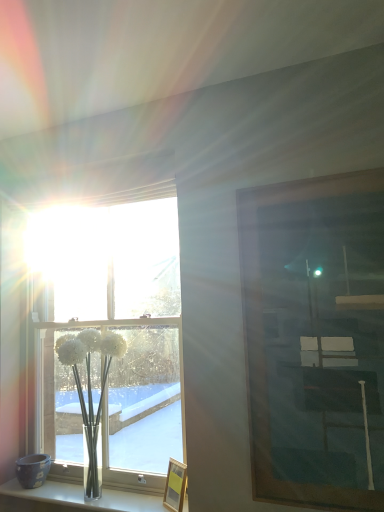
Question: From a real-world perspective, is white glass vase at lower left located beneath clear glass vase at lower left?

Choices:
 (A) yes
 (B) no

Answer: (B)

Question: Is white glass vase at lower left at the left side of clear glass vase at lower left?

Choices:
 (A) yes
 (B) no

Answer: (B)

Question: Is white glass vase at lower left wider than clear glass vase at lower left?

Choices:
 (A) no
 (B) yes

Answer: (B)

Question: From the image's perspective, is white glass vase at lower left below clear glass vase at lower left?

Choices:
 (A) yes
 (B) no

Answer: (B)

Question: Is white glass vase at lower left further to the viewer compared to clear glass vase at lower left?

Choices:
 (A) no
 (B) yes

Answer: (B)

Question: Would you say white glass vase at lower left is a long distance from clear glass vase at lower left?

Choices:
 (A) no
 (B) yes

Answer: (A)

Question: Is the depth of clear glass vase at lower left greater than that of wooden picture frame at lower center, which is the 2th picture frame in top-to-bottom order?

Choices:
 (A) no
 (B) yes

Answer: (A)

Question: From the image's perspective, is clear glass vase at lower left above wooden picture frame at lower center, which is the second picture frame in right-to-left order?

Choices:
 (A) yes
 (B) no

Answer: (B)

Question: Is clear glass vase at lower left bigger than wooden picture frame at lower center, which is the 2th picture frame in top-to-bottom order?

Choices:
 (A) no
 (B) yes

Answer: (B)

Question: Can you confirm if clear glass vase at lower left is wider than wooden picture frame at lower center, the first picture frame when ordered from left to right?

Choices:
 (A) yes
 (B) no

Answer: (A)

Question: Considering the relative sizes of clear glass vase at lower left and wooden picture frame at lower center, placed as the 1th picture frame when sorted from back to front, in the image provided, is clear glass vase at lower left taller than wooden picture frame at lower center, placed as the 1th picture frame when sorted from back to front,?

Choices:
 (A) yes
 (B) no

Answer: (B)

Question: Considering the relative sizes of clear glass vase at lower left and wooden picture frame at lower center, the first picture frame when ordered from left to right, in the image provided, is clear glass vase at lower left smaller than wooden picture frame at lower center, the first picture frame when ordered from left to right,?

Choices:
 (A) no
 (B) yes

Answer: (A)

Question: Considering the relative positions of clear glass vase at lower left and white glass vase at lower left in the image provided, is clear glass vase at lower left to the left of white glass vase at lower left from the viewer's perspective?

Choices:
 (A) yes
 (B) no

Answer: (A)